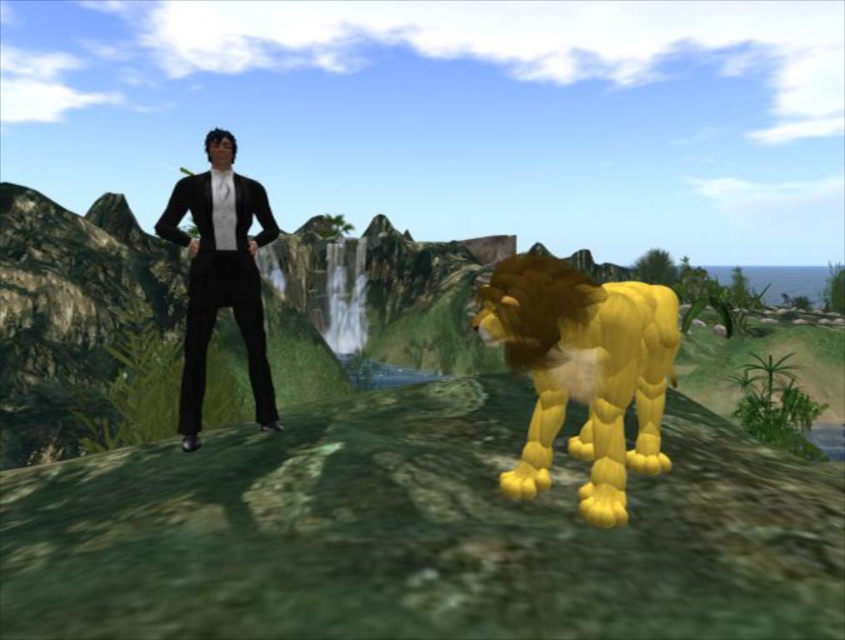
Based on the photo, who is positioned more to the left, yellow matte lion at center or black glossy suit at center?

From the viewer's perspective, black glossy suit at center appears more on the left side.

Is yellow matte lion at center taller than black glossy suit at center?

Yes, yellow matte lion at center is taller than black glossy suit at center.

Who is more forward, (x=608, y=384) or (x=208, y=304)?

Point (x=608, y=384) is in front.

Where is `yellow matte lion at center`? The width and height of the screenshot is (845, 640). yellow matte lion at center is located at coordinates (582, 371).